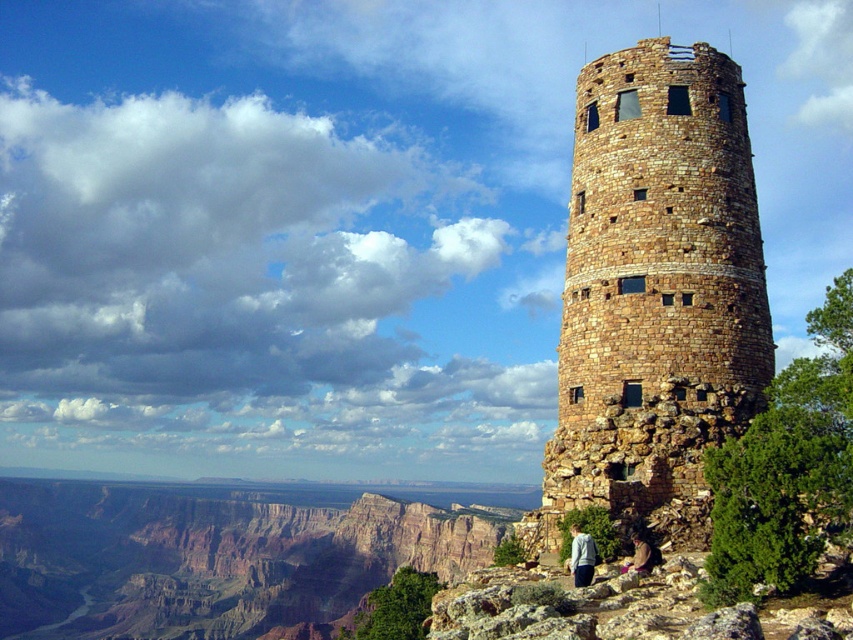
Is light blue fabric jacket at lower center further to the viewer compared to brown leather jacket at lower center?

No, it is not.

Measure the distance between light blue fabric jacket at lower center and brown leather jacket at lower center.

The distance of light blue fabric jacket at lower center from brown leather jacket at lower center is 4.84 feet.

Between point (572, 524) and point (624, 566), which one is positioned in front?

Point (624, 566)

The height and width of the screenshot is (640, 853). In order to click on light blue fabric jacket at lower center in this screenshot , I will do `click(582, 556)`.

Between point (648, 125) and point (577, 525), which one is positioned in front?

Point (577, 525)

Does point (653, 492) lie behind point (579, 556)?

Yes, point (653, 492) is behind point (579, 556).

Where is `brown stone tower at center`? Image resolution: width=853 pixels, height=640 pixels. brown stone tower at center is located at coordinates (654, 291).

Which is below, brown stone tower at center or brown leather jacket at lower center?

brown leather jacket at lower center

Who is positioned more to the right, brown stone tower at center or brown leather jacket at lower center?

brown stone tower at center

Between point (642, 371) and point (637, 570), which one is positioned in front?

Point (637, 570) is in front.

Find the location of a particular element. The height and width of the screenshot is (640, 853). brown stone tower at center is located at coordinates (654, 291).